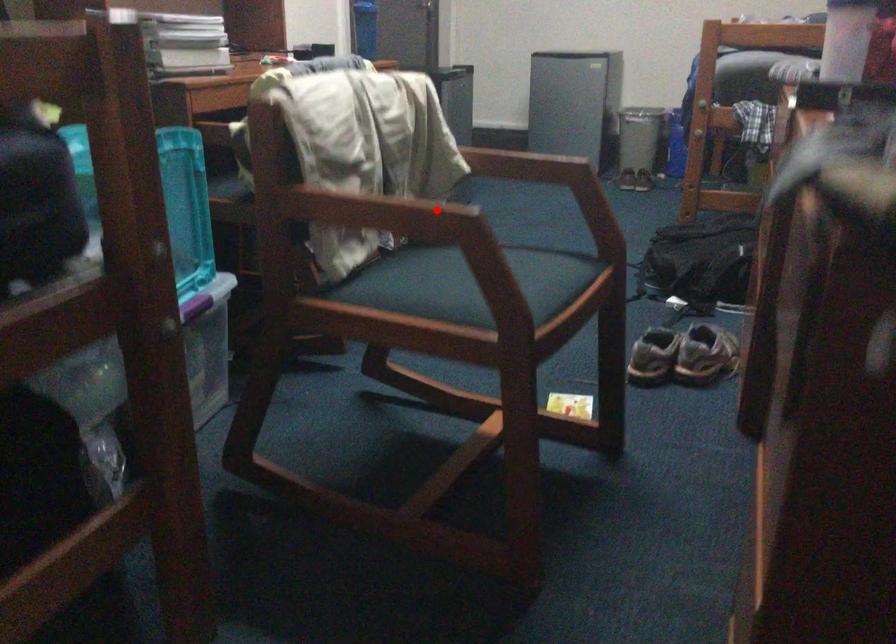
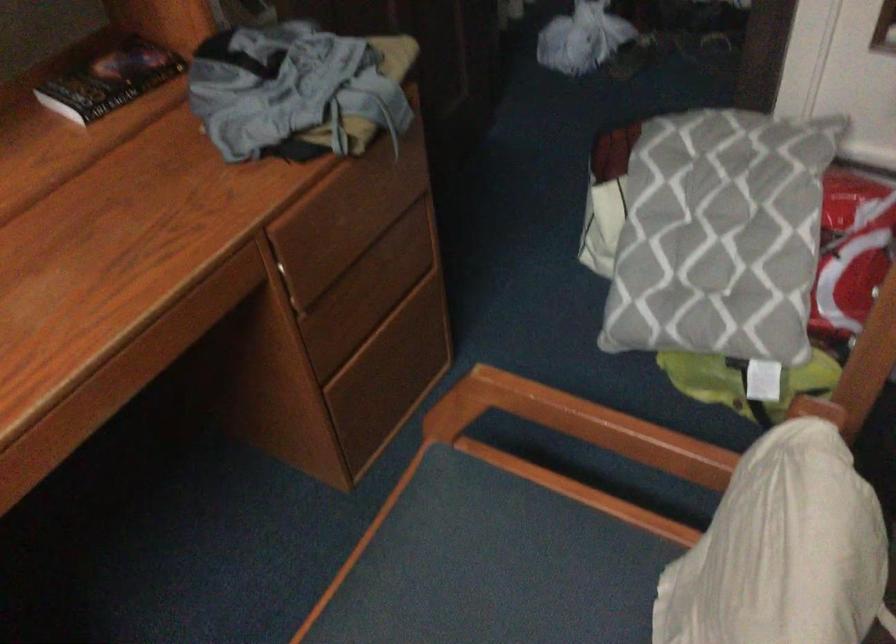
Question: I am providing you with two images of the same scene from different viewpoints. A red point is marked on the first image. Can you still see the location of the red point in image 2?

Choices:
 (A) Yes
 (B) No

Answer: (B)